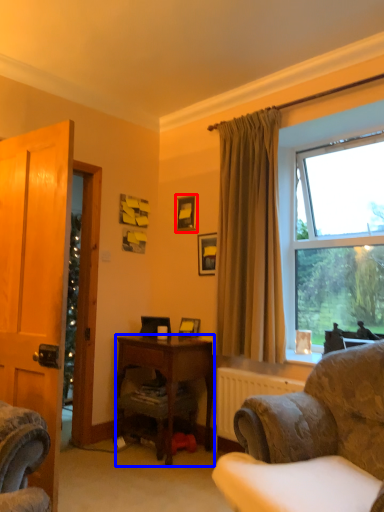
Question: Which of the following is the closest to the observer, picture frame (highlighted by a red box) or desk (highlighted by a blue box)?

Choices:
 (A) picture frame
 (B) desk

Answer: (B)